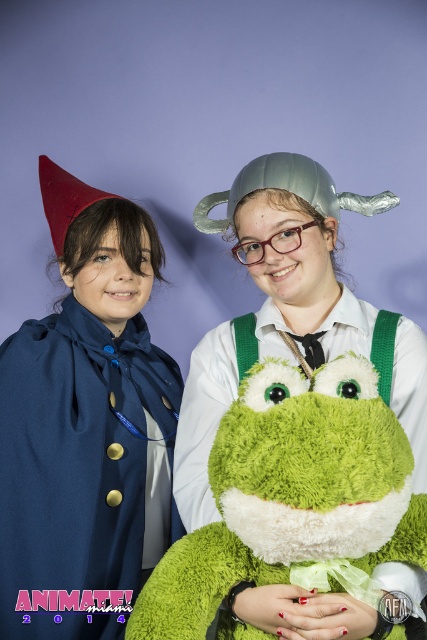
Is matte blue cape at left shorter than green plush frog at center?

No.

Which is above, matte blue cape at left or green plush frog at center?

Positioned higher is matte blue cape at left.

Does point (53, 572) come farther from viewer compared to point (286, 512)?

Yes.

Where is `matte blue cape at left`? The width and height of the screenshot is (427, 640). matte blue cape at left is located at coordinates (85, 426).